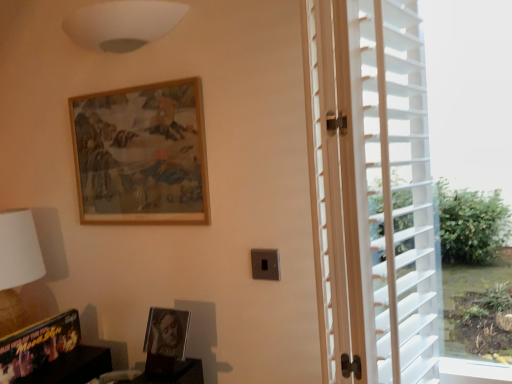
Question: Is white wooden blinds at right turned away from white plastic blinds at right?

Choices:
 (A) yes
 (B) no

Answer: (A)

Question: From the image's perspective, is white wooden blinds at right below white plastic blinds at right?

Choices:
 (A) yes
 (B) no

Answer: (A)

Question: Can you confirm if white wooden blinds at right is bigger than white plastic blinds at right?

Choices:
 (A) no
 (B) yes

Answer: (B)

Question: Is white wooden blinds at right positioned far away from white plastic blinds at right?

Choices:
 (A) yes
 (B) no

Answer: (B)

Question: Is the position of white wooden blinds at right less distant than that of white plastic blinds at right?

Choices:
 (A) yes
 (B) no

Answer: (A)

Question: Considering the relative sizes of white wooden blinds at right and white plastic blinds at right in the image provided, is white wooden blinds at right taller than white plastic blinds at right?

Choices:
 (A) no
 (B) yes

Answer: (A)

Question: Considering the relative positions of matte black picture frame at lower center, arranged as the second picture frame when ordered from the bottom, and wooden frame at upper center, which is the third picture frame in bottom-to-top order, in the image provided, is matte black picture frame at lower center, arranged as the second picture frame when ordered from the bottom, behind wooden frame at upper center, which is the third picture frame in bottom-to-top order,?

Choices:
 (A) no
 (B) yes

Answer: (A)

Question: From the image's perspective, is matte black picture frame at lower center, arranged as the second picture frame when ordered from the bottom, on top of wooden frame at upper center, which is the third picture frame in bottom-to-top order?

Choices:
 (A) yes
 (B) no

Answer: (B)

Question: Would you say matte black picture frame at lower center, arranged as the second picture frame when ordered from the bottom, contains wooden frame at upper center, which is the third picture frame in bottom-to-top order?

Choices:
 (A) no
 (B) yes

Answer: (A)

Question: Does matte black picture frame at lower center, which ranks as the 2th picture frame in top-to-bottom order, have a greater height compared to wooden frame at upper center, placed as the 1th picture frame when sorted from top to bottom?

Choices:
 (A) no
 (B) yes

Answer: (A)

Question: Is matte black picture frame at lower center, arranged as the second picture frame when ordered from the bottom, outside wooden frame at upper center, which is the third picture frame in bottom-to-top order?

Choices:
 (A) yes
 (B) no

Answer: (A)

Question: Can you confirm if matte black picture frame at lower center, which ranks as the 2th picture frame in top-to-bottom order, is bigger than wooden frame at upper center, which is the third picture frame in bottom-to-top order?

Choices:
 (A) no
 (B) yes

Answer: (A)

Question: Is wooden frame at upper center, placed as the 1th picture frame when sorted from top to bottom, facing away from white matte lampshade at upper center?

Choices:
 (A) yes
 (B) no

Answer: (B)